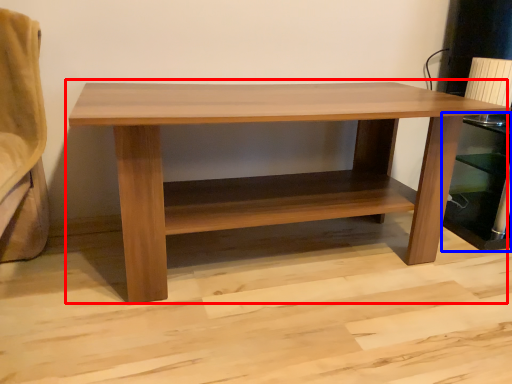
Question: Which object appears farthest to the camera in this image, table (highlighted by a red box) or shelf (highlighted by a blue box)?

Choices:
 (A) table
 (B) shelf

Answer: (B)